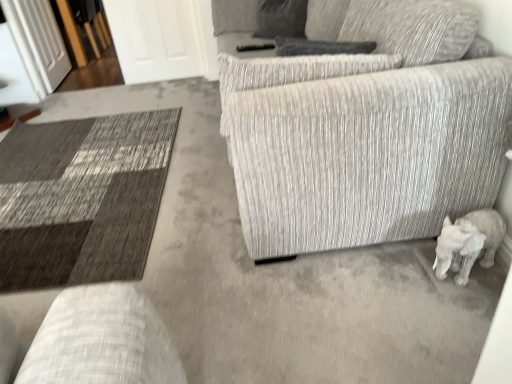
Question: Could you tell me if white matte elephant at lower right is facing gray fabric pillow at upper center?

Choices:
 (A) yes
 (B) no

Answer: (B)

Question: From a real-world perspective, is white matte elephant at lower right on gray fabric pillow at upper center?

Choices:
 (A) no
 (B) yes

Answer: (A)

Question: Is white matte elephant at lower right bigger than gray fabric pillow at upper center?

Choices:
 (A) yes
 (B) no

Answer: (B)

Question: Is white matte elephant at lower right behind gray fabric pillow at upper center?

Choices:
 (A) no
 (B) yes

Answer: (A)

Question: Can you confirm if white matte elephant at lower right is wider than gray fabric pillow at upper center?

Choices:
 (A) no
 (B) yes

Answer: (B)

Question: Is gray fabric pillow at upper center situated inside white glossy door at upper left, acting as the first glass door starting from the right, or outside?

Choices:
 (A) inside
 (B) outside

Answer: (B)

Question: Is gray fabric pillow at upper center to the left or to the right of white glossy door at upper left, which is counted as the second glass door, starting from the left, in the image?

Choices:
 (A) left
 (B) right

Answer: (B)

Question: Is point (274, 14) closer or farther from the camera than point (198, 44)?

Choices:
 (A) closer
 (B) farther

Answer: (A)

Question: Considering their positions, is gray fabric pillow at upper center located in front of or behind white glossy door at upper left, acting as the first glass door starting from the right?

Choices:
 (A) behind
 (B) front

Answer: (B)

Question: Choose the correct answer: Is textured gray couch at center inside white glossy door at upper left, acting as the first glass door starting from the right, or outside it?

Choices:
 (A) outside
 (B) inside

Answer: (A)

Question: Looking at the image, does textured gray couch at center seem bigger or smaller compared to white glossy door at upper left, acting as the first glass door starting from the right?

Choices:
 (A) small
 (B) big

Answer: (B)

Question: Considering the positions of point (390, 226) and point (168, 34), is point (390, 226) closer or farther from the camera than point (168, 34)?

Choices:
 (A) closer
 (B) farther

Answer: (A)

Question: Visually, is textured gray couch at center positioned to the left or to the right of white glossy door at upper left, which is counted as the second glass door, starting from the left?

Choices:
 (A) right
 (B) left

Answer: (A)

Question: From the image's perspective, is textured gray couch at center located above or below white matte elephant at lower right?

Choices:
 (A) above
 (B) below

Answer: (A)

Question: Considering their positions, is textured gray couch at center located in front of or behind white matte elephant at lower right?

Choices:
 (A) front
 (B) behind

Answer: (A)